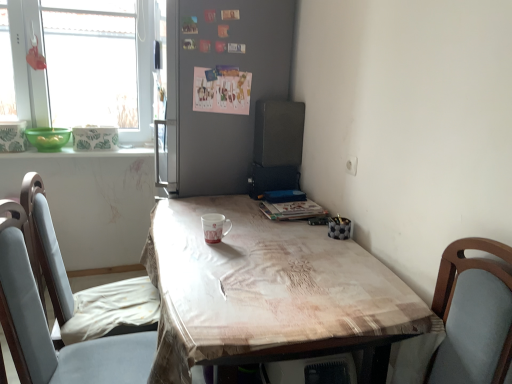
Question: In terms of width, does transparent glass window at upper left look wider or thinner when compared to green glossy bowls at left?

Choices:
 (A) wide
 (B) thin

Answer: (A)

Question: Is transparent glass window at upper left to the left or to the right of green glossy bowls at left in the image?

Choices:
 (A) right
 (B) left

Answer: (A)

Question: Which is farther from the green matte bowl at left?

Choices:
 (A) light blue fabric chair at lower left
 (B) transparent glass window at upper left
 (C) matte gray bulletin board at center
 (D) black matte speaker at upper right
 (E) green glossy bowls at left

Answer: (A)

Question: Which of these objects is positioned farthest from the green matte bowl at left?

Choices:
 (A) white glossy mug at center
 (B) light brown fabric table at center
 (C) green glossy bowls at left
 (D) black matte speaker at upper right
 (E) transparent glass window at upper left

Answer: (B)